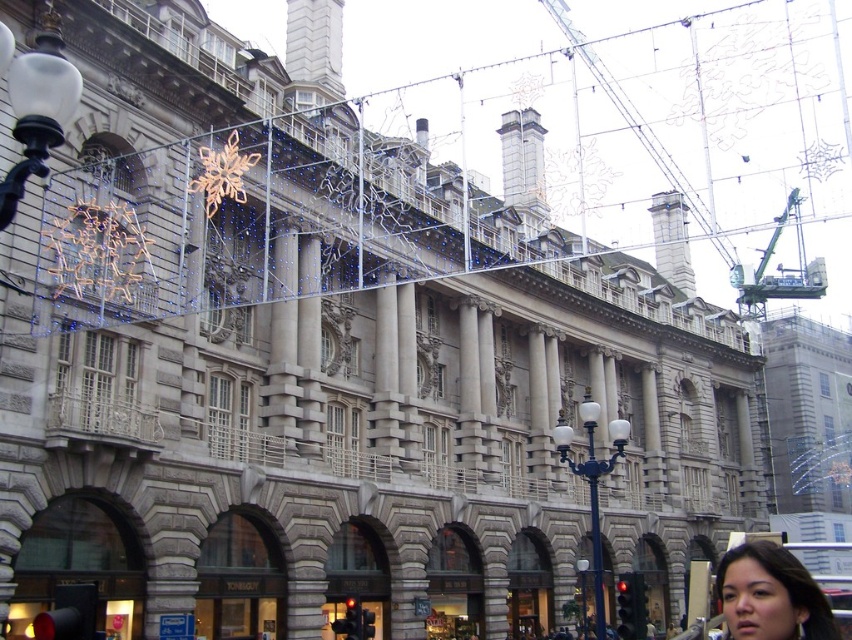
Question: Observing the image, what is the correct spatial positioning of green metallic crane at upper center in reference to smooth skin face at lower right?

Choices:
 (A) below
 (B) above

Answer: (B)

Question: Which object is closer to the camera taking this photo?

Choices:
 (A) smooth skin face at lower right
 (B) green metallic crane at upper center

Answer: (A)

Question: Does green metallic crane at upper center come in front of green metallic crane at upper right?

Choices:
 (A) no
 (B) yes

Answer: (B)

Question: Is green metallic crane at upper center below green metallic crane at upper right?

Choices:
 (A) yes
 (B) no

Answer: (B)

Question: Which object is closer to the camera taking this photo?

Choices:
 (A) smooth skin face at lower right
 (B) green metallic crane at upper center

Answer: (A)

Question: Estimate the real-world distances between objects in this image. Which object is farther from the smooth skin face at lower right?

Choices:
 (A) green metallic crane at upper right
 (B) green metallic crane at upper center

Answer: (B)